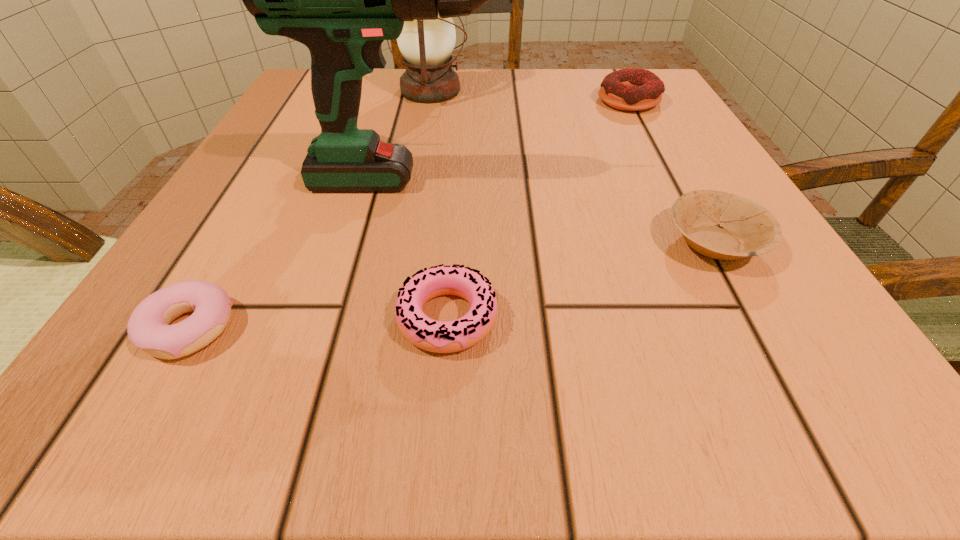
Locate an element on the screen. vacant area in the image that satisfies the following two spatial constraints: 1. on the back side of the second doughnut from right to left; 2. on the handle side of the drill is located at coordinates (456, 181).

Locate an element on the screen. vacant point that satisfies the following two spatial constraints: 1. on the handle side of the fourth nearest object; 2. on the right side of the second doughnut from right to left is located at coordinates (397, 318).

The image size is (960, 540). I want to click on vacant point that satisfies the following two spatial constraints: 1. on the front side of the oil lamp; 2. on the left side of the fourth farthest object, so click(x=403, y=242).